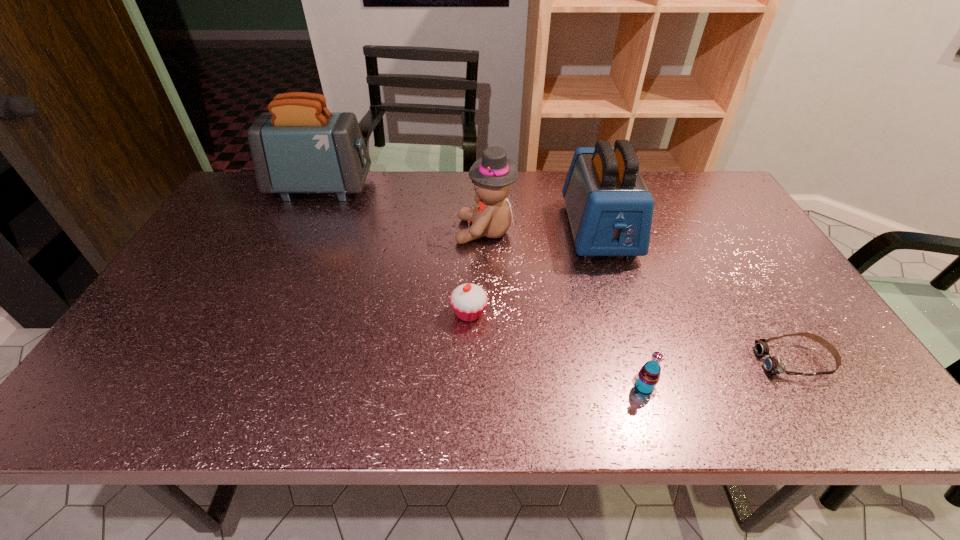
What are the coordinates of `goggles located at the near edge` in the screenshot? It's located at (773, 364).

This screenshot has width=960, height=540. In order to click on object that is at the left edge in this screenshot , I will do `click(299, 146)`.

Find the location of a particular element. object that is positioned at the right edge is located at coordinates (773, 364).

Image resolution: width=960 pixels, height=540 pixels. What are the coordinates of `object that is at the far left corner` in the screenshot? It's located at (299, 146).

Locate an element on the screen. This screenshot has width=960, height=540. object positioned at the near right corner is located at coordinates (773, 364).

The image size is (960, 540). What are the coordinates of `vacant space at the far edge of the desktop` in the screenshot? It's located at (658, 175).

Locate an element on the screen. vacant area at the near edge of the desktop is located at coordinates (516, 388).

Identify the location of vacant region at the left edge of the desktop. (237, 232).

Identify the location of free space at the right edge. The height and width of the screenshot is (540, 960). (718, 251).

Locate an element on the screen. The width and height of the screenshot is (960, 540). free region at the far right corner of the desktop is located at coordinates (687, 184).